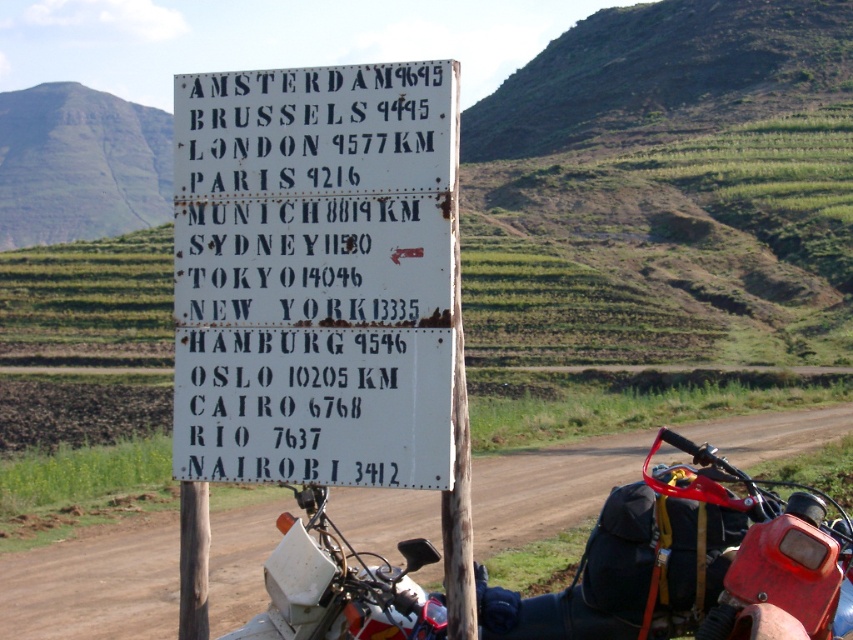
What are the coordinates of `white paper sign at center` in the screenshot? It's located at (314, 275).

Does white paper sign at center appear under red plastic motorcycle at lower right?

No.

Who is more distant from viewer, (350, 442) or (608, 624)?

The point (608, 624) is more distant.

You are a GUI agent. You are given a task and a screenshot of the screen. Output one action in this format:
    pyautogui.click(x=<x>, y=<y>)
    Task: Click on the white paper sign at center
    The image size is (853, 640).
    Given the screenshot: What is the action you would take?
    pyautogui.click(x=314, y=275)